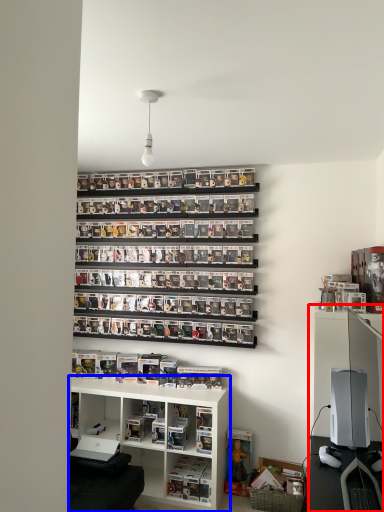
Question: Which object is closer to the camera taking this photo, entertainment center (highlighted by a red box) or shelf (highlighted by a blue box)?

Choices:
 (A) entertainment center
 (B) shelf

Answer: (A)